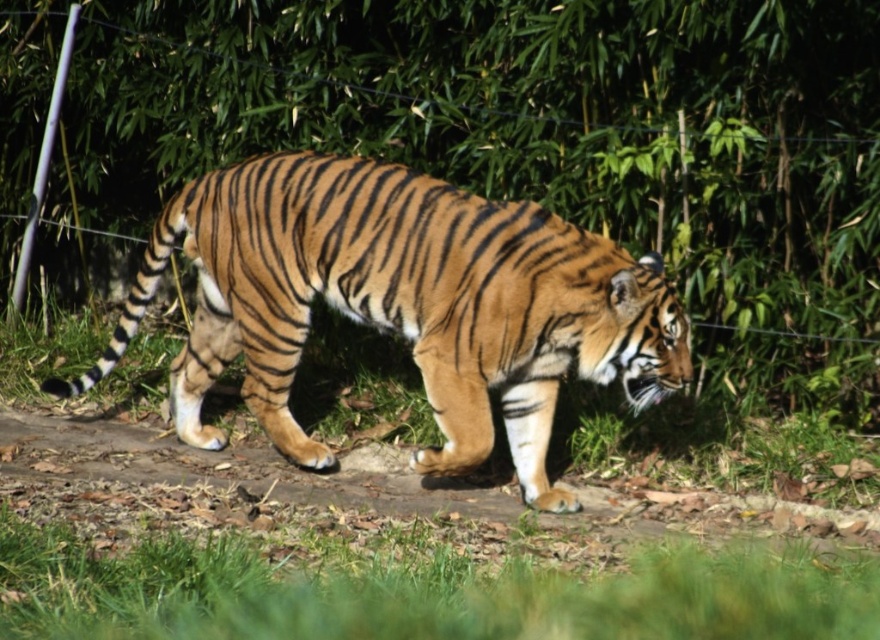
Is wire mesh at center further to the viewer compared to brown dirt path at center?

That is True.

Who is positioned more to the right, wire mesh at center or brown dirt path at center?

wire mesh at center is more to the right.

Image resolution: width=880 pixels, height=640 pixels. I want to click on wire mesh at center, so click(517, 138).

Does orange-brown fur tiger at center have a smaller size compared to brown dirt path at center?

No, orange-brown fur tiger at center is not smaller than brown dirt path at center.

Which of these two, orange-brown fur tiger at center or brown dirt path at center, stands taller?

With more height is orange-brown fur tiger at center.

Between point (511, 298) and point (635, 532), which one is positioned behind?

Point (635, 532)

Where is `orange-brown fur tiger at center`? The width and height of the screenshot is (880, 640). orange-brown fur tiger at center is located at coordinates (402, 304).

Is point (57, 28) closer to viewer compared to point (544, 468)?

That is False.

Who is positioned more to the right, wire mesh at center or orange-brown fur tiger at center?

Positioned to the right is wire mesh at center.

Does point (283, 42) come in front of point (646, 292)?

No, (283, 42) is further to viewer.

Identify the location of wire mesh at center. The height and width of the screenshot is (640, 880). (517, 138).